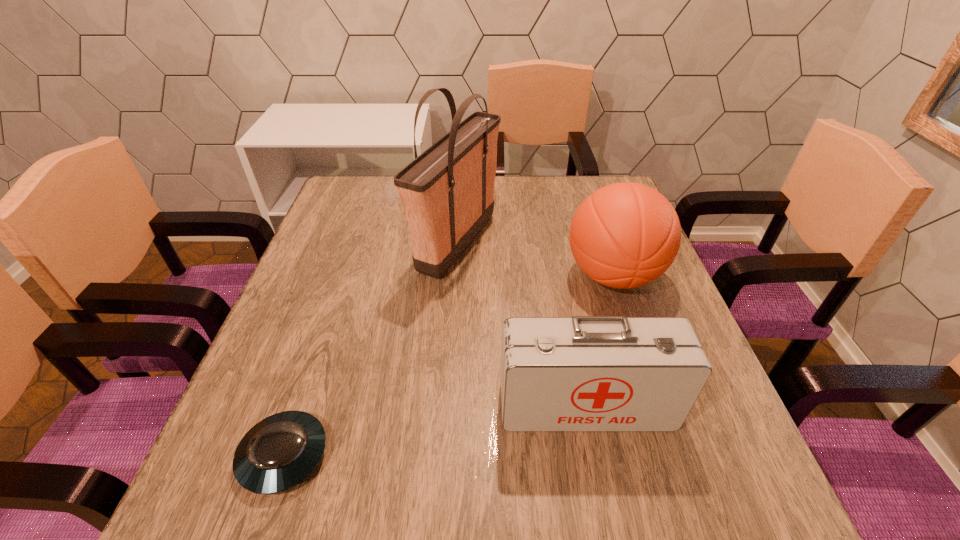
The height and width of the screenshot is (540, 960). In order to click on object positioned at the near edge in this screenshot , I will do `click(279, 452)`.

The height and width of the screenshot is (540, 960). Find the location of `object at the left edge`. object at the left edge is located at coordinates (279, 452).

The width and height of the screenshot is (960, 540). I want to click on basketball located in the right edge section of the desktop, so click(625, 235).

At what (x,y) coordinates should I click in order to perform the action: click on the first-aid kit present at the right edge. Please return your answer as a coordinate pair (x, y). This screenshot has width=960, height=540. Looking at the image, I should click on (582, 373).

Where is `object that is at the near left corner`? Image resolution: width=960 pixels, height=540 pixels. object that is at the near left corner is located at coordinates (279, 452).

The height and width of the screenshot is (540, 960). In the image, there is a desktop. In order to click on free space at the far edge in this screenshot , I will do `click(516, 183)`.

You are a GUI agent. You are given a task and a screenshot of the screen. Output one action in this format:
    pyautogui.click(x=<x>, y=<y>)
    Task: Click on the blank area at the near edge
    The height and width of the screenshot is (540, 960).
    Given the screenshot: What is the action you would take?
    pyautogui.click(x=416, y=521)

Locate an element on the screen. The height and width of the screenshot is (540, 960). free spot at the left edge of the desktop is located at coordinates (306, 264).

I want to click on free space at the right edge of the desktop, so click(725, 429).

Image resolution: width=960 pixels, height=540 pixels. Identify the location of vacant space at the far right corner. (570, 185).